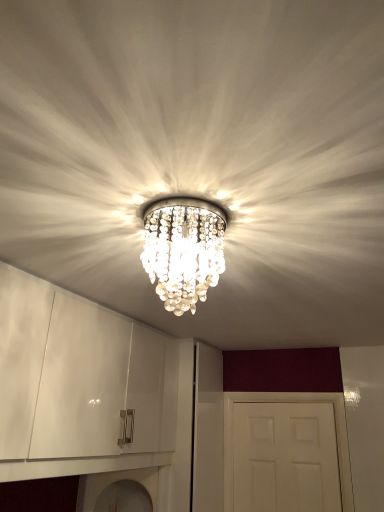
Question: From the image's perspective, is white matte door at center positioned above or below clear crystal chandelier at center?

Choices:
 (A) above
 (B) below

Answer: (B)

Question: Is white matte door at center inside or outside of clear crystal chandelier at center?

Choices:
 (A) inside
 (B) outside

Answer: (B)

Question: Does point (304, 432) appear closer or farther from the camera than point (190, 278)?

Choices:
 (A) farther
 (B) closer

Answer: (A)

Question: Does point (180, 275) appear closer or farther from the camera than point (268, 476)?

Choices:
 (A) closer
 (B) farther

Answer: (A)

Question: From a real-world perspective, is clear crystal chandelier at center above or below white matte door at center?

Choices:
 (A) above
 (B) below

Answer: (A)

Question: In the image, is clear crystal chandelier at center on the left side or the right side of white matte door at center?

Choices:
 (A) left
 (B) right

Answer: (A)

Question: Which is correct: clear crystal chandelier at center is inside white matte door at center, or outside of it?

Choices:
 (A) outside
 (B) inside

Answer: (A)